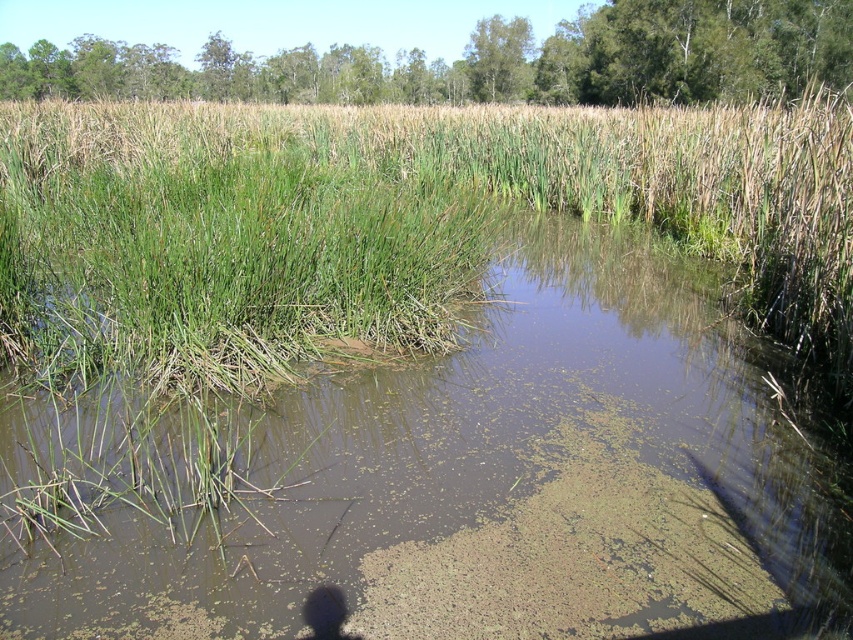
Between brown murky water at center and green grass at center, which one is positioned lower?

brown murky water at center is lower down.

Is brown murky water at center below green grass at center?

Yes, brown murky water at center is below green grass at center.

Is point (85, 596) positioned behind point (722, 257)?

No, (85, 596) is closer to viewer.

The image size is (853, 640). I want to click on brown murky water at center, so click(492, 484).